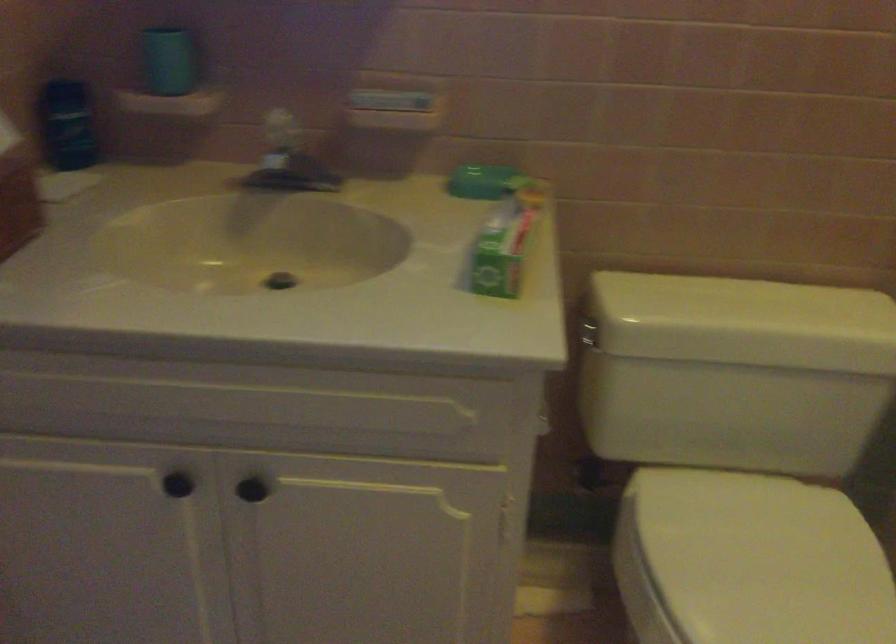
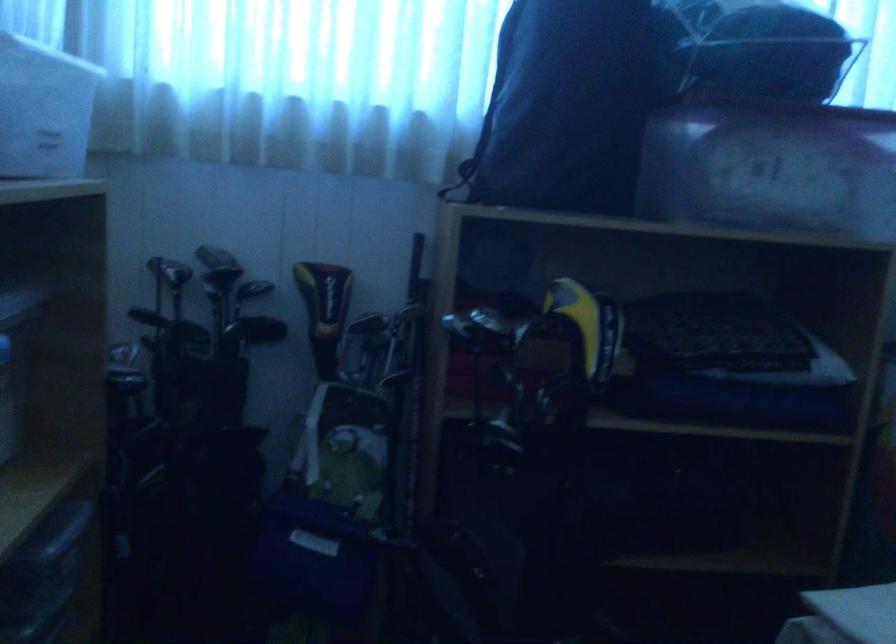
Question: What movement of the cameraman would produce the second image?

Choices:
 (A) Left
 (B) Right
 (C) Forward
 (D) Backward

Answer: (A)